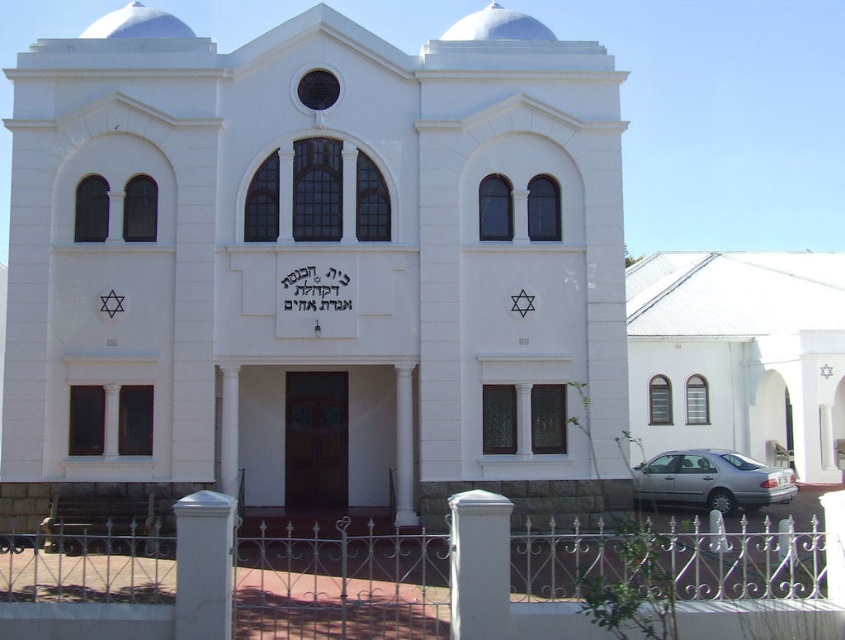
You are driving a car and see the white stone church at center and the silver metallic car at lower right. Which object is closer to you?

The white stone church at center is closer to you because it is in front of the silver metallic car at lower right.

You are standing in front of the synagogue and notice two points marked on the building. The first point is located at coordinates point [820,282] and the second at point [780,492]. Which point appears closer to your eyes when looking at the building?

Point [820,282] is further to the camera than point [780,492], so the point [780,492] appears closer to your eyes when looking at the building.

You are standing in front of the synagogue and want to take a photo of the white smooth chapel at lower right and the silver metallic car at lower right. Which one should you focus on first to ensure it appears larger in your photo?

The white smooth chapel at lower right is closer to the viewer than the silver metallic car at lower right, so focusing on it first will make it appear larger in the photo.